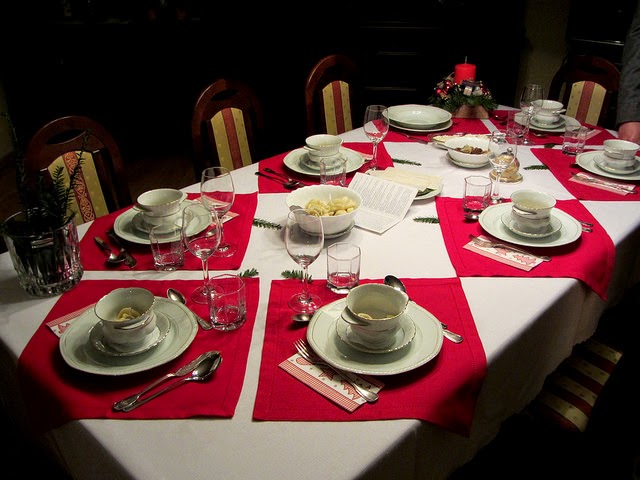
You are a GUI agent. You are given a task and a screenshot of the screen. Output one action in this format:
    pyautogui.click(x=<x>, y=<y>)
    Task: Click on the green plant springs
    This screenshot has width=640, height=480.
    Given the screenshot: What is the action you would take?
    pyautogui.click(x=424, y=221), pyautogui.click(x=292, y=273), pyautogui.click(x=251, y=273), pyautogui.click(x=262, y=225), pyautogui.click(x=402, y=158), pyautogui.click(x=532, y=166)